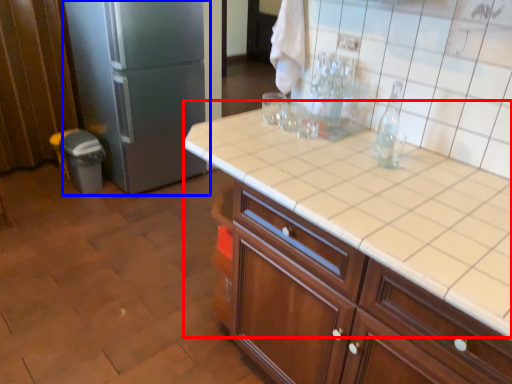
Question: Which of the following is the closest to the observer, table (highlighted by a red box) or refrigerator (highlighted by a blue box)?

Choices:
 (A) table
 (B) refrigerator

Answer: (A)